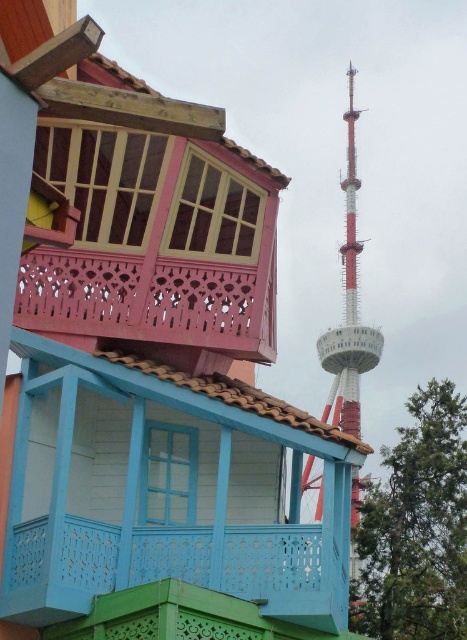
Can you confirm if blue painted wood balcony at center is smaller than pink woodwork balcony at upper left?

No, blue painted wood balcony at center is not smaller than pink woodwork balcony at upper left.

Does blue painted wood balcony at center have a lesser height compared to pink woodwork balcony at upper left?

No.

Which is in front, point (263, 499) or point (183, 154)?

Point (183, 154) is in front.

Where is `blue painted wood balcony at center`? This screenshot has height=640, width=467. blue painted wood balcony at center is located at coordinates (167, 504).

Does blue painted wood balcony at center appear under red and white painted tower at upper right?

Correct, blue painted wood balcony at center is located below red and white painted tower at upper right.

In the scene shown: Who is positioned more to the left, blue painted wood balcony at center or red and white painted tower at upper right?

Positioned to the left is blue painted wood balcony at center.

Is point (40, 545) closer to camera compared to point (352, 358)?

Yes, it is in front of point (352, 358).

You are a GUI agent. You are given a task and a screenshot of the screen. Output one action in this format:
    pyautogui.click(x=<x>, y=<y>)
    Task: Click on the blue painted wood balcony at center
    Image resolution: width=467 pixels, height=640 pixels.
    Given the screenshot: What is the action you would take?
    pyautogui.click(x=167, y=504)

This screenshot has width=467, height=640. Find the location of `pink woodwork balcony at upper left`. pink woodwork balcony at upper left is located at coordinates (155, 243).

Is point (163, 202) positioned before point (345, 115)?

Yes.

You are a GUI agent. You are given a task and a screenshot of the screen. Output one action in this format:
    pyautogui.click(x=<x>, y=<y>)
    Task: Click on the pink woodwork balcony at upper left
    The image size is (467, 640).
    Given the screenshot: What is the action you would take?
    pyautogui.click(x=155, y=243)